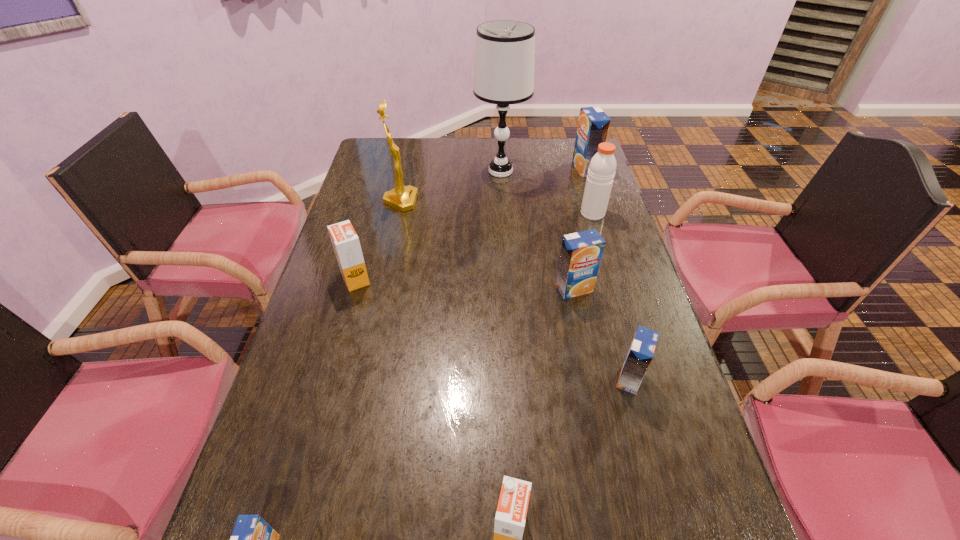
Locate an element on the screen. This screenshot has height=540, width=960. blue orange_juice identified as the closest to the farthest blue orange_juice is located at coordinates (581, 252).

Locate an element on the screen. Image resolution: width=960 pixels, height=540 pixels. orange orange juice that is the closest to the eighth shortest object is located at coordinates (346, 244).

At what (x,y) coordinates should I click in order to perform the action: click on free spot that satisfies the following two spatial constraints: 1. on the front-facing side of the eighth shortest object; 2. on the right side of the second farthest blue orange_juice. Please return your answer as a coordinate pair (x, y). The image size is (960, 540). Looking at the image, I should click on (381, 289).